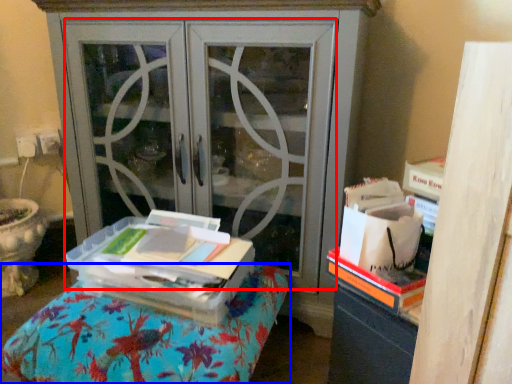
Question: Which of the following is the farthest to the observer, screen door (highlighted by a red box) or furniture (highlighted by a blue box)?

Choices:
 (A) screen door
 (B) furniture

Answer: (A)